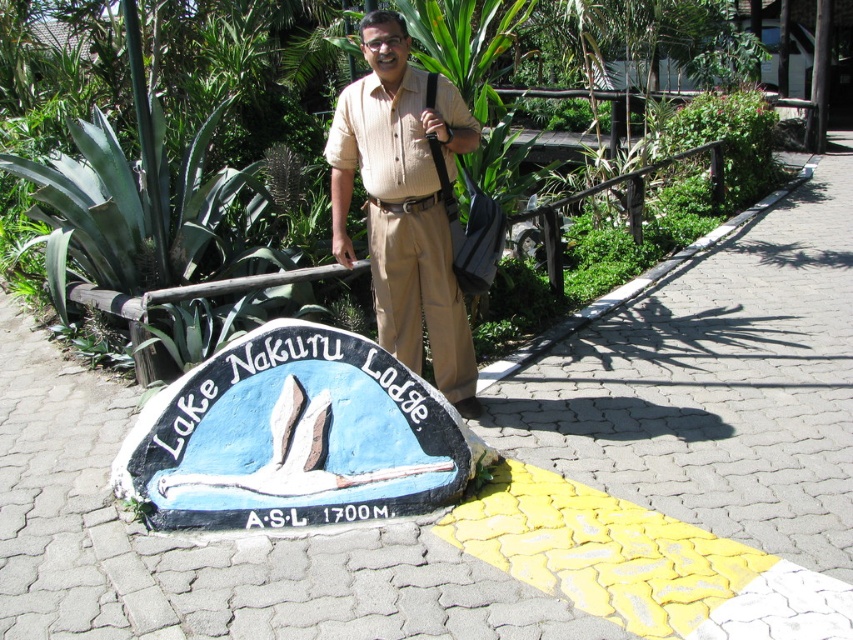
Question: Considering the real-world distances, which object is closest to the beige striped shirt at center?

Choices:
 (A) green leafy plant at center
 (B) blue painted stone lake nakuru lodge sign at center

Answer: (B)

Question: From the image, what is the correct spatial relationship of blue painted stone lake nakuru lodge sign at center in relation to green leafy plant at center?

Choices:
 (A) right
 (B) left

Answer: (A)

Question: Can you confirm if blue painted stone lake nakuru lodge sign at center is positioned above beige striped shirt at center?

Choices:
 (A) no
 (B) yes

Answer: (A)

Question: Which object appears closest to the camera in this image?

Choices:
 (A) blue painted stone lake nakuru lodge sign at center
 (B) green leafy plant at center

Answer: (A)

Question: Among these objects, which one is farthest from the camera?

Choices:
 (A) beige striped shirt at center
 (B) blue painted stone lake nakuru lodge sign at center
 (C) green leafy plant at center

Answer: (C)

Question: Is blue painted stone lake nakuru lodge sign at center smaller than beige striped shirt at center?

Choices:
 (A) yes
 (B) no

Answer: (A)